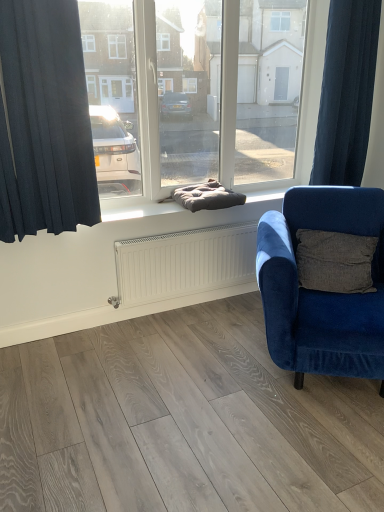
Locate an element on the screen. The height and width of the screenshot is (512, 384). vacant space underneath dark blue fabric curtain at left, which ranks as the 1th curtain in left-to-right order (from a real-world perspective) is located at coordinates (77, 332).